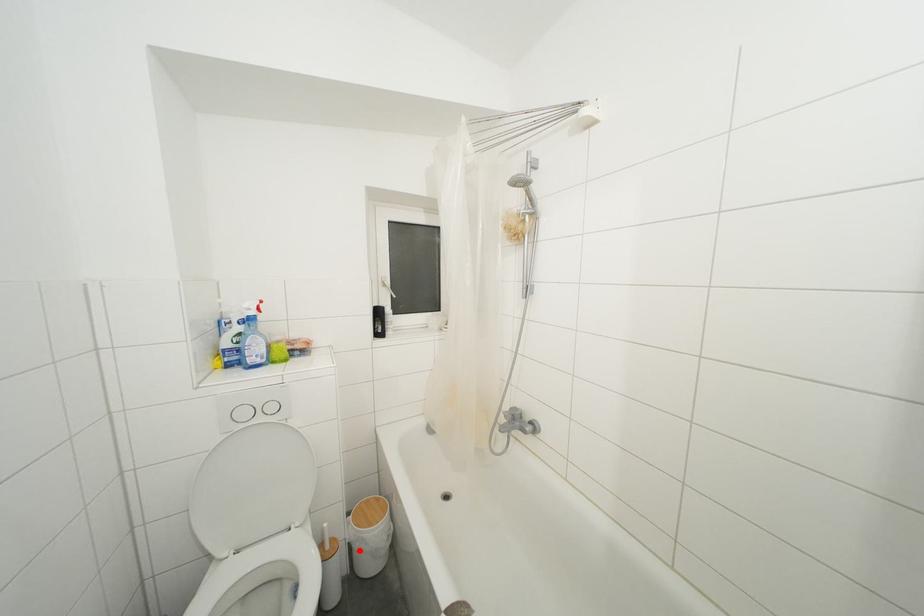
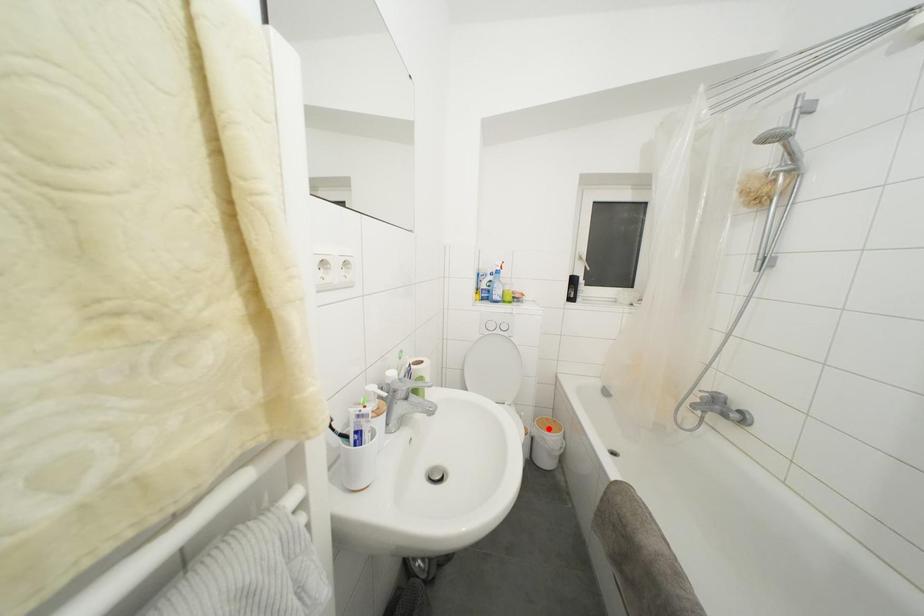
I am providing you with two images of the same scene from different viewpoints. A red point is marked on the first image and another point is marked on the second image. Is the red point in image1 aligned with the point shown in image2?

No